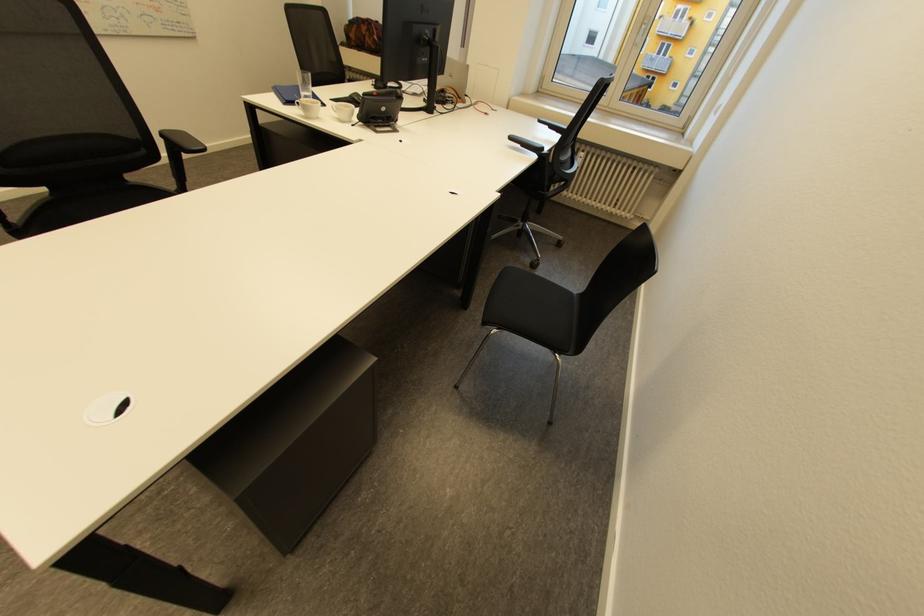
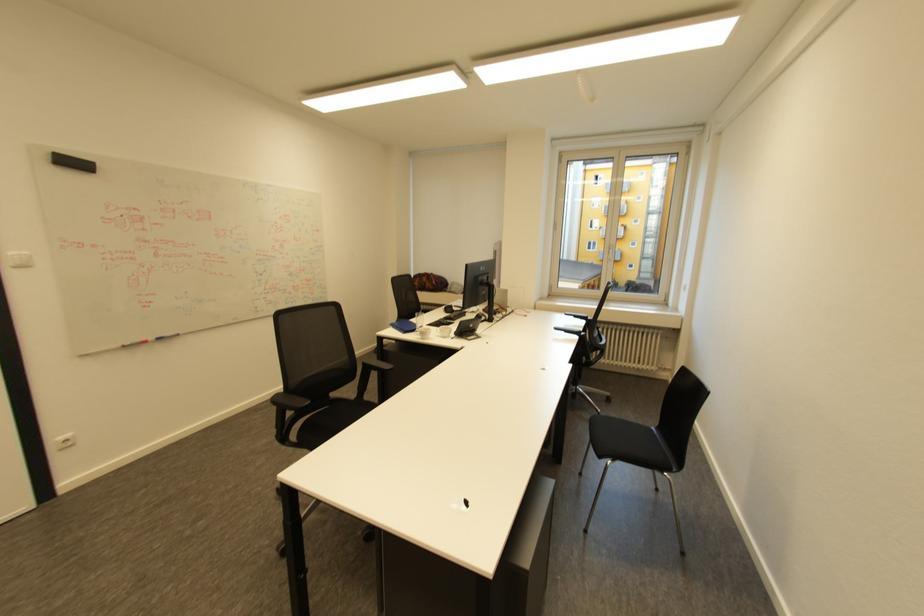
Find the pixel in the second image that matches point (167, 135) in the first image.

(370, 363)